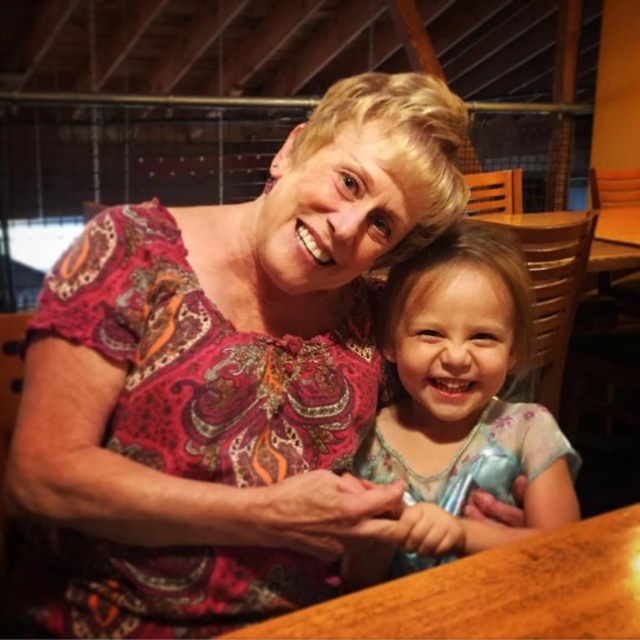
Question: Based on their relative distances, which object is nearer to the wooden table at center?

Choices:
 (A) patterned fabric blouse at upper left
 (B) light blue floral dress at center

Answer: (B)

Question: Does patterned fabric blouse at upper left have a smaller size compared to light blue floral dress at center?

Choices:
 (A) yes
 (B) no

Answer: (B)

Question: Can you confirm if light blue floral dress at center is thinner than wooden table at center?

Choices:
 (A) no
 (B) yes

Answer: (B)

Question: Which point is closer to the camera taking this photo?

Choices:
 (A) (536, 456)
 (B) (163, 362)
 (C) (545, 536)

Answer: (C)

Question: Is patterned fabric blouse at upper left to the left of wooden table at center from the viewer's perspective?

Choices:
 (A) no
 (B) yes

Answer: (B)

Question: Estimate the real-world distances between objects in this image. Which object is closer to the patterned fabric blouse at upper left?

Choices:
 (A) light blue floral dress at center
 (B) wooden table at center

Answer: (A)